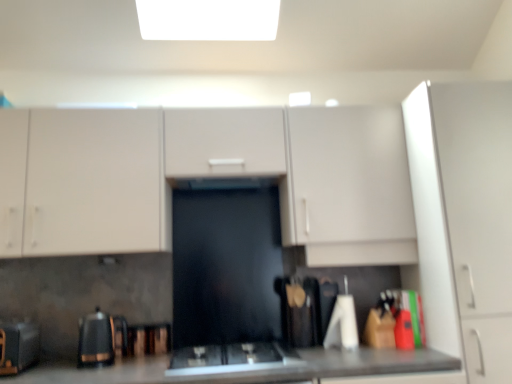
Question: Can you confirm if white matte cabinet at right, positioned as the 1th cabinetry in right-to-left order, is shorter than black glass gas stove at center?

Choices:
 (A) no
 (B) yes

Answer: (A)

Question: Is white matte cabinet at right, positioned as the 1th cabinetry in right-to-left order, turned away from black glass gas stove at center?

Choices:
 (A) no
 (B) yes

Answer: (A)

Question: Is white matte cabinet at right, which is the second cabinetry from left to right, taller than black glass gas stove at center?

Choices:
 (A) yes
 (B) no

Answer: (A)

Question: Can you confirm if white matte cabinet at right, which is the second cabinetry from left to right, is wider than black glass gas stove at center?

Choices:
 (A) yes
 (B) no

Answer: (A)

Question: Can you confirm if white matte cabinet at right, positioned as the 1th cabinetry in right-to-left order, is thinner than black glass gas stove at center?

Choices:
 (A) yes
 (B) no

Answer: (B)

Question: Is white matte cabinet at right, which is the second cabinetry from left to right, aimed at black glass gas stove at center?

Choices:
 (A) yes
 (B) no

Answer: (B)

Question: Does black matte toaster at lower left, which is the 1th appliance from left to right, have a lesser width compared to black glass gas stove at center?

Choices:
 (A) no
 (B) yes

Answer: (B)

Question: Is the depth of black matte toaster at lower left, which is the 1th appliance from left to right, greater than that of black glass gas stove at center?

Choices:
 (A) yes
 (B) no

Answer: (A)

Question: Considering the relative sizes of black matte toaster at lower left, which is counted as the third appliance, starting from the right, and black glass gas stove at center in the image provided, is black matte toaster at lower left, which is counted as the third appliance, starting from the right, shorter than black glass gas stove at center?

Choices:
 (A) no
 (B) yes

Answer: (A)

Question: Is black matte toaster at lower left, which is counted as the third appliance, starting from the right, smaller than black glass gas stove at center?

Choices:
 (A) no
 (B) yes

Answer: (A)

Question: Can black glass gas stove at center be found inside black matte toaster at lower left, which is counted as the third appliance, starting from the right?

Choices:
 (A) yes
 (B) no

Answer: (B)

Question: Is black glass gas stove at center at the back of black matte toaster at lower left, which is counted as the third appliance, starting from the right?

Choices:
 (A) yes
 (B) no

Answer: (B)

Question: Does black glass gas stove at center turn towards wooden spatula at center, which ranks as the 1th appliance in right-to-left order?

Choices:
 (A) yes
 (B) no

Answer: (B)